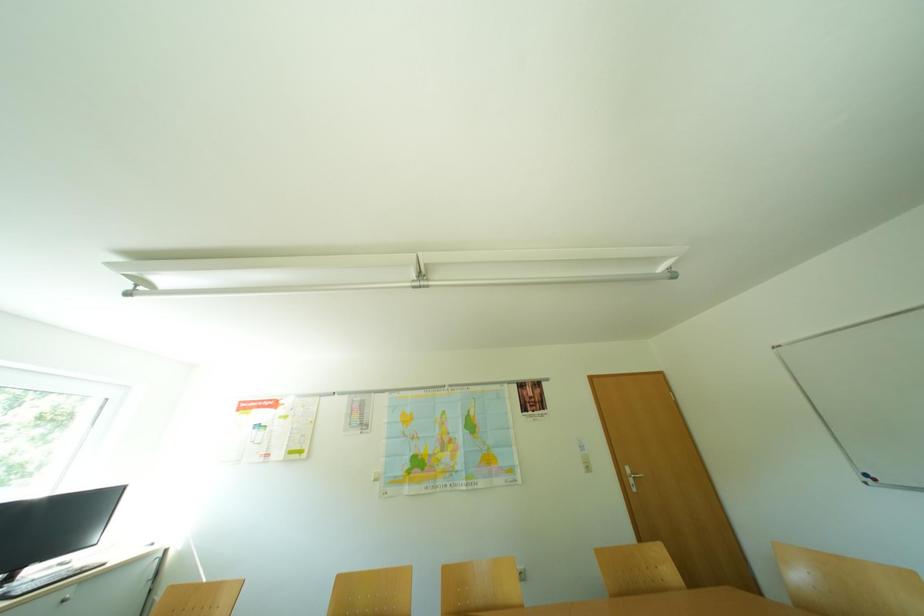
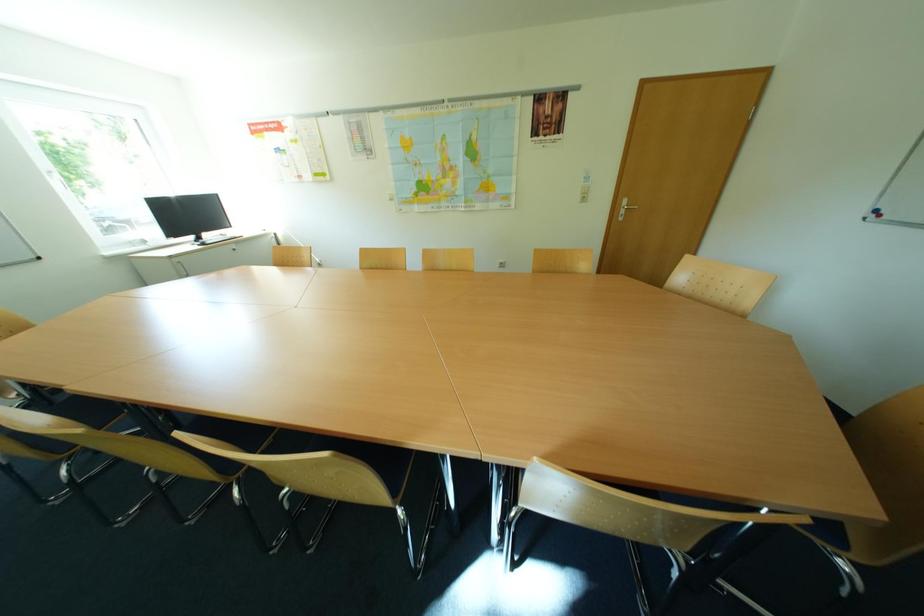
The first image is from the beginning of the video and the second image is from the end. How did the camera likely rotate when shooting the video?

The camera's rotation is toward left-down.